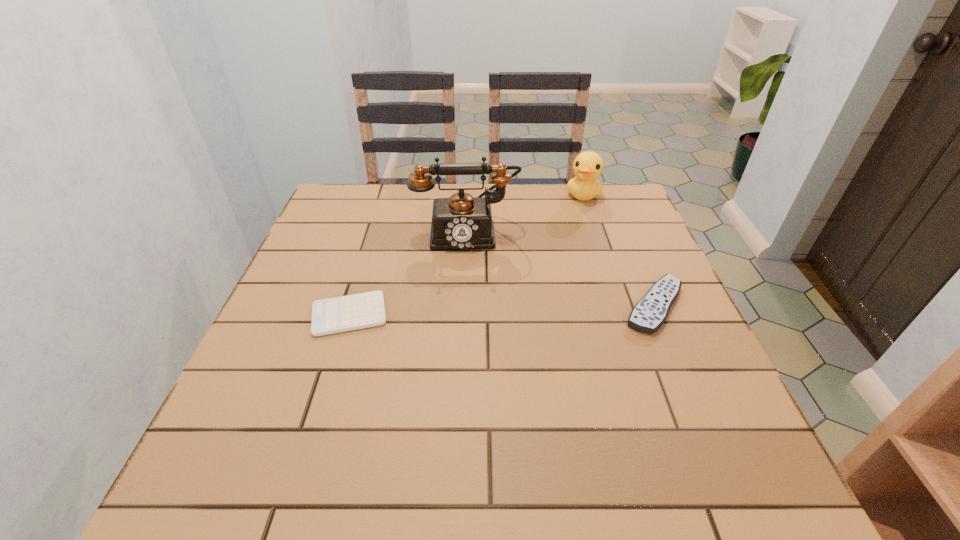
Where is `calculator`? Image resolution: width=960 pixels, height=540 pixels. calculator is located at coordinates (333, 315).

Identify the location of the leftmost object. (333, 315).

I want to click on the third tallest object, so 648,315.

This screenshot has width=960, height=540. Find the location of `telephone`. telephone is located at coordinates (461, 222).

Find the location of a particular element. The height and width of the screenshot is (540, 960). the tallest object is located at coordinates (461, 222).

Where is `the third shortest object`? the third shortest object is located at coordinates (587, 166).

At what (x,y) coordinates should I click in order to perform the action: click on the farthest object. Please return your answer as a coordinate pair (x, y). The image size is (960, 540). Looking at the image, I should click on (587, 166).

In order to click on vacant space located on the left of the calculator in this screenshot , I will do `click(284, 314)`.

Find the location of a particular element. The image size is (960, 540). free region located on the back of the remote control is located at coordinates (619, 222).

This screenshot has width=960, height=540. Identify the location of vacant point located on the front of the second farthest object at the rotary dial. (468, 267).